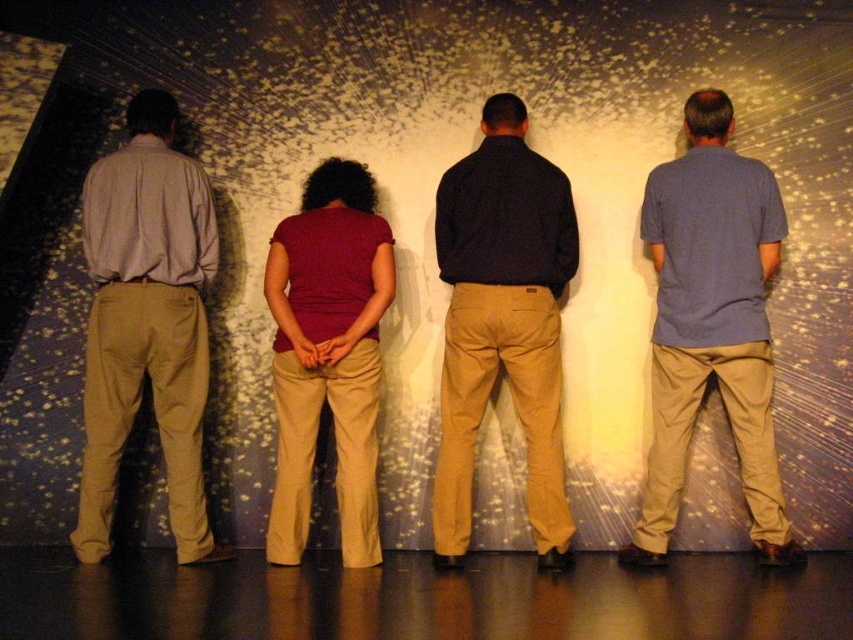
You are organizing a photo shoot and need to ensure that the spacing between the matte khaki pants at left and the matte blue shirt at right is sufficient for a group photo. Based on their widths, which object requires more space between them to accommodate their sizes?

The matte blue shirt at right requires more space between them because its width is greater than the matte khaki pants at left.

Based on the photo, you are standing in front of a group photo with four people against a starry backdrop. You notice a point marked at coordinates (x=711, y=324). Which person is closest to this point?

The point at (x=711, y=324) indicates the matte blue shirt at right, so the person wearing the dark blue long sleeved shirt at right is closest to this point.

You are an event photographer who needs to adjust the lighting for a group photo. You notice two blue shirts in the scene. The matte blue shirt at right and the dark blue shirt at center. Which of these two shirts is positioned lower in the frame?

The matte blue shirt at right is located below the dark blue shirt at center, so it is positioned lower in the frame.